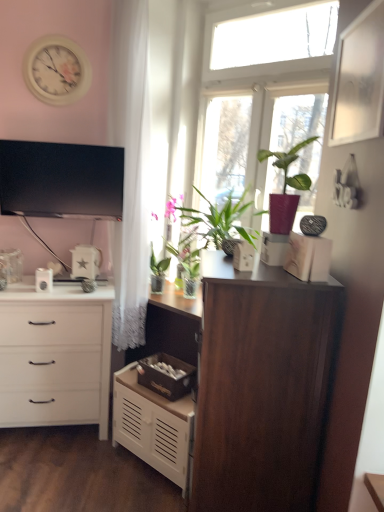
Describe the element at coordinates (55, 356) in the screenshot. I see `white matte chest of drawers at left, which appears as the 2th chest of drawers when viewed from the right` at that location.

In order to click on white glossy kettle at left, the 2th appliance viewed from the back in this screenshot , I will do `click(44, 280)`.

Image resolution: width=384 pixels, height=512 pixels. Identify the location of black glossy tv at upper left. (61, 180).

Is matte pink pot at center taller or shorter than matte white storage box at upper center, the first storage box viewed from the front?

In the image, matte pink pot at center appears to be taller than matte white storage box at upper center, the first storage box viewed from the front.

From the image's perspective, is matte pink pot at center below matte white storage box at upper center, the first storage box viewed from the front?

Actually, matte pink pot at center appears above matte white storage box at upper center, the first storage box viewed from the front, in the image.

Is matte pink pot at center inside or outside of matte white storage box at upper center, which is counted as the 2th storage box, starting from the left?

matte pink pot at center is not inside matte white storage box at upper center, which is counted as the 2th storage box, starting from the left, it's outside.

Could you tell me if matte pink pot at center is turned towards matte white storage box at upper center, marked as the first storage box in a top-to-bottom arrangement?

No, matte pink pot at center does not turn towards matte white storage box at upper center, marked as the first storage box in a top-to-bottom arrangement.

Is white matte chest of drawers at left, which appears as the 2th chest of drawers when viewed from the right, with black glossy tv at upper left?

No, white matte chest of drawers at left, which appears as the 2th chest of drawers when viewed from the right, is not touching black glossy tv at upper left.

Is white matte chest of drawers at left, acting as the 1th chest of drawers starting from the left, wider or thinner than black glossy tv at upper left?

Clearly, white matte chest of drawers at left, acting as the 1th chest of drawers starting from the left, has more width compared to black glossy tv at upper left.

Considering the relative sizes of white matte chest of drawers at left, acting as the 1th chest of drawers starting from the left, and black glossy tv at upper left in the image provided, is white matte chest of drawers at left, acting as the 1th chest of drawers starting from the left, bigger than black glossy tv at upper left?

Correct, white matte chest of drawers at left, acting as the 1th chest of drawers starting from the left, is larger in size than black glossy tv at upper left.

Would you say white matte chest of drawers at left, which appears as the 2th chest of drawers when viewed from the right, is outside black glossy tv at upper left?

Yes, white matte chest of drawers at left, which appears as the 2th chest of drawers when viewed from the right, is outside of black glossy tv at upper left.

Are white glossy toaster at center, which is counted as the 1th appliance, starting from the right, and white glossy star-shaped object at center, placed as the 2th appliance when sorted from right to left, far apart?

No, there isn't a large distance between white glossy toaster at center, which is counted as the 1th appliance, starting from the right, and white glossy star-shaped object at center, placed as the 2th appliance when sorted from right to left.

Between white glossy toaster at center, which is the third appliance in left-to-right order, and white glossy star-shaped object at center, which ranks as the third appliance in front-to-back order, which one has smaller size?

white glossy toaster at center, which is the third appliance in left-to-right order.

Does point (240, 257) appear closer or farther from the camera than point (76, 255)?

Point (240, 257) is positioned closer to the camera compared to point (76, 255).

Based on their positions, is white glossy kettle at left, the first appliance when ordered from left to right, located to the left or right of brown wooden storage box at center, positioned as the first storage box in back-to-front order?

In the image, white glossy kettle at left, the first appliance when ordered from left to right, appears on the left side of brown wooden storage box at center, positioned as the first storage box in back-to-front order.

Looking at their sizes, would you say white glossy kettle at left, the third appliance when ordered from right to left, is wider or thinner than brown wooden storage box at center, the first storage box from the left?

white glossy kettle at left, the third appliance when ordered from right to left, is thinner than brown wooden storage box at center, the first storage box from the left.

Can you confirm if white glossy kettle at left, the 2th appliance viewed from the back, is bigger than brown wooden storage box at center, which is counted as the second storage box, starting from the top?

No, white glossy kettle at left, the 2th appliance viewed from the back, is not bigger than brown wooden storage box at center, which is counted as the second storage box, starting from the top.

How much distance is there between white glossy kettle at left, the third appliance when ordered from right to left, and brown wooden storage box at center, positioned as the first storage box in back-to-front order?

white glossy kettle at left, the third appliance when ordered from right to left, is 81.96 centimeters from brown wooden storage box at center, positioned as the first storage box in back-to-front order.

Is white sheer curtain at left facing away from black glossy tv at upper left?

Yes, white sheer curtain at left is positioned with its back facing black glossy tv at upper left.

In the scene shown: What's the angular difference between white sheer curtain at left and black glossy tv at upper left's facing directions?

There is a 48.6-degree angle between the facing directions of white sheer curtain at left and black glossy tv at upper left.

Between white sheer curtain at left and black glossy tv at upper left, which one has less height?

black glossy tv at upper left.

From the picture: Is white sheer curtain at left positioned in front of black glossy tv at upper left?

Yes, white sheer curtain at left is closer to the viewer.

Is brown wooden storage box at center, the first storage box from the left, directly adjacent to white glossy kettle at left, the first appliance when ordered from left to right?

No.

Does brown wooden storage box at center, the first storage box from the left, have a smaller size compared to white glossy kettle at left, which is counted as the second appliance, starting from the front?

No, brown wooden storage box at center, the first storage box from the left, is not smaller than white glossy kettle at left, which is counted as the second appliance, starting from the front.

Considering their positions, is brown wooden storage box at center, acting as the second storage box starting from the right, located in front of or behind white glossy kettle at left, the third appliance when ordered from right to left?

brown wooden storage box at center, acting as the second storage box starting from the right, is in front of white glossy kettle at left, the third appliance when ordered from right to left.

From a real-world perspective, between brown wooden storage box at center, acting as the second storage box starting from the right, and white glossy kettle at left, which is counted as the second appliance, starting from the front, who is vertically higher?

white glossy kettle at left, which is counted as the second appliance, starting from the front, from a real-world perspective.

From a real-world perspective, who is located higher, black glossy tv at upper left or white matte chest of drawers at lower center, which is the 1th chest of drawers in right-to-left order?

From a 3D spatial view, black glossy tv at upper left is above.

Find the location of `television above the white matte chest of drawers at lower center, positioned as the 2th chest of drawers in left-to-right order (from the image's perspective)`. television above the white matte chest of drawers at lower center, positioned as the 2th chest of drawers in left-to-right order (from the image's perspective) is located at coordinates (61, 180).

Does black glossy tv at upper left turn towards white matte chest of drawers at lower center, positioned as the 2th chest of drawers in left-to-right order?

No, black glossy tv at upper left is not turned towards white matte chest of drawers at lower center, positioned as the 2th chest of drawers in left-to-right order.

Is black glossy tv at upper left far from white matte chest of drawers at lower center, positioned as the 2th chest of drawers in left-to-right order?

Yes, black glossy tv at upper left and white matte chest of drawers at lower center, positioned as the 2th chest of drawers in left-to-right order, are located far from each other.

At what (x,y) coordinates should I click in order to perform the action: click on the 1st storage box positioned below the matte pink pot at center (from a real-world perspective). Please return your answer as a coordinate pair (x, y). The image size is (384, 512). Looking at the image, I should click on (274, 248).

You are a GUI agent. You are given a task and a screenshot of the screen. Output one action in this format:
    pyautogui.click(x=<x>, y=<y>)
    Task: Click on the television that is above the white matte chest of drawers at left, acting as the 1th chest of drawers starting from the left (from a real-world perspective)
    This screenshot has height=512, width=384.
    Given the screenshot: What is the action you would take?
    pyautogui.click(x=61, y=180)

Which object lies nearer to the anchor point brown wooden storage box at center, the 2th storage box from the front, white glossy star-shaped object at center, placed as the 2th appliance when sorted from right to left, or dark wood cupboard at center?

white glossy star-shaped object at center, placed as the 2th appliance when sorted from right to left, is positioned closer to the anchor brown wooden storage box at center, the 2th storage box from the front.

Considering their positions, is white glossy star-shaped object at center, which is counted as the first appliance, starting from the back, positioned closer to matte pink pot at center than white sheer curtain at left?

white sheer curtain at left is positioned closer to the anchor matte pink pot at center.

Estimate the real-world distances between objects in this image. Which object is closer to white glossy star-shaped object at center, which ranks as the third appliance in front-to-back order, clear glass window at upper center or brown wooden storage box at center, the 2th storage box from the front?

Among the two, brown wooden storage box at center, the 2th storage box from the front, is located nearer to white glossy star-shaped object at center, which ranks as the third appliance in front-to-back order.

Looking at the image, which one is located closer to matte pink pot at center, white matte chest of drawers at lower center, positioned as the 2th chest of drawers in left-to-right order, or white glossy kettle at left, which is counted as the second appliance, starting from the front?

white matte chest of drawers at lower center, positioned as the 2th chest of drawers in left-to-right order, is closer to matte pink pot at center.

Based on their spatial positions, is white glossy kettle at left, the 2th appliance viewed from the back, or brown wooden storage box at center, acting as the second storage box starting from the right, closer to white glossy star-shaped object at center, placed as the 2th appliance when sorted from right to left?

The object closer to white glossy star-shaped object at center, placed as the 2th appliance when sorted from right to left, is white glossy kettle at left, the 2th appliance viewed from the back.

From the picture: When comparing their distances from white glossy clock at upper left, does black glossy tv at upper left or white matte chest of drawers at lower center, which is the 1th chest of drawers in right-to-left order, seem further?

white matte chest of drawers at lower center, which is the 1th chest of drawers in right-to-left order.

Considering their positions, is white sheer curtain at left positioned further to white glossy star-shaped object at center, which is counted as the first appliance, starting from the back, than black glossy tv at upper left?

The object further to white glossy star-shaped object at center, which is counted as the first appliance, starting from the back, is white sheer curtain at left.

Based on their spatial positions, is white glossy toaster at center, which is the third appliance in left-to-right order, or white glossy clock at upper left further from black glossy tv at upper left?

Among the two, white glossy toaster at center, which is the third appliance in left-to-right order, is located further to black glossy tv at upper left.

I want to click on storage box between white glossy kettle at left, the third appliance when ordered from right to left, and dark wood cupboard at center from left to right, so click(x=166, y=376).

Where is `curtain located between white glossy star-shaped object at center, which ranks as the third appliance in front-to-back order, and clear glass window at upper center in the left-right direction`? curtain located between white glossy star-shaped object at center, which ranks as the third appliance in front-to-back order, and clear glass window at upper center in the left-right direction is located at coordinates click(130, 169).

Locate an element on the screen. television that lies between white glossy clock at upper left and white matte chest of drawers at lower center, which is the 1th chest of drawers in right-to-left order, from top to bottom is located at coordinates (61, 180).

Find the location of `television between white glossy toaster at center, which is the third appliance in left-to-right order, and white glossy star-shaped object at center, placed as the 2th appliance when sorted from right to left, from front to back`. television between white glossy toaster at center, which is the third appliance in left-to-right order, and white glossy star-shaped object at center, placed as the 2th appliance when sorted from right to left, from front to back is located at coordinates (61, 180).